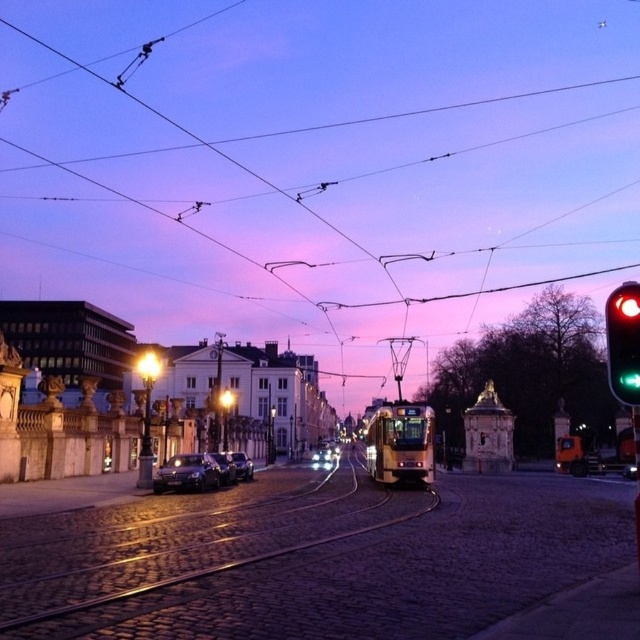
You are a city planner assessing the street layout. Given the metallic wire at center and the green glass traffic light at right, which object has a greater width?

The metallic wire at center has a greater width than the green glass traffic light at right.

You are a pedestrian standing at the edge of the cobblestone road. You see the metallic wire at center and the sleek silver sedan at center. Which object is closer to the left side of the road?

The metallic wire at center is closer to the left side of the road because it is positioned to the left of the sleek silver sedan at center.